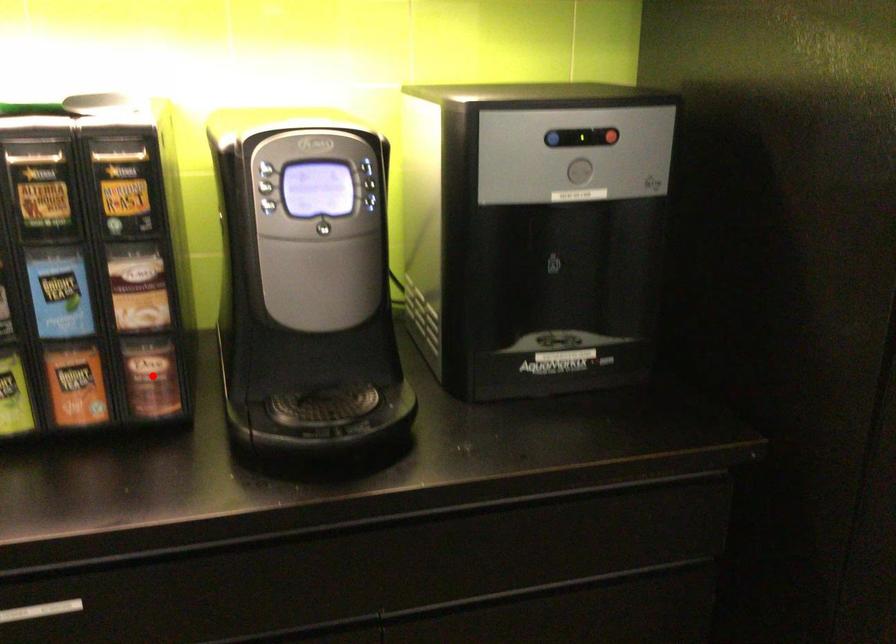
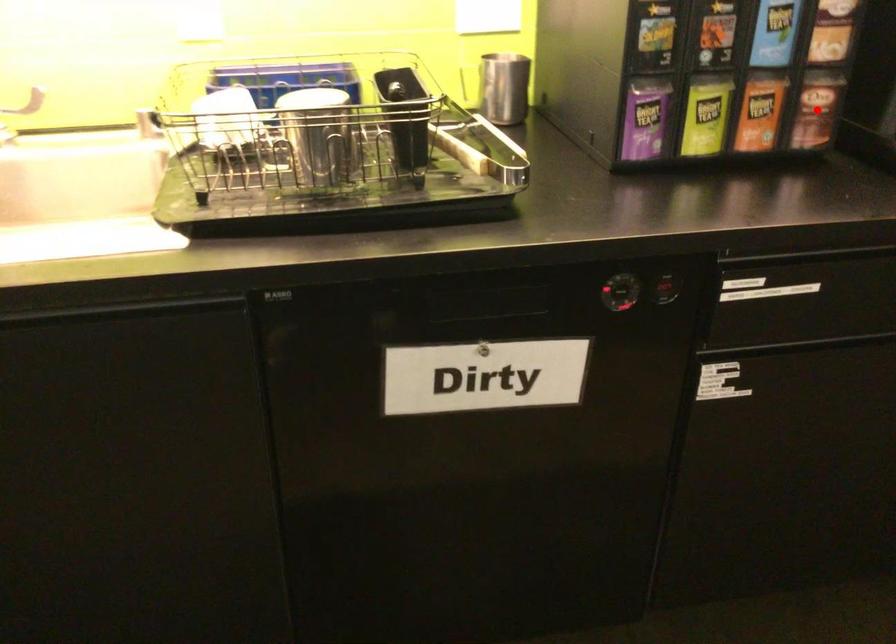
Looking at this image, I am providing you with two images of the same scene from different viewpoints. A red point is marked on the first image and another point is marked on the second image. Is the marked point in image1 the same physical position as the marked point in image2?

Yes